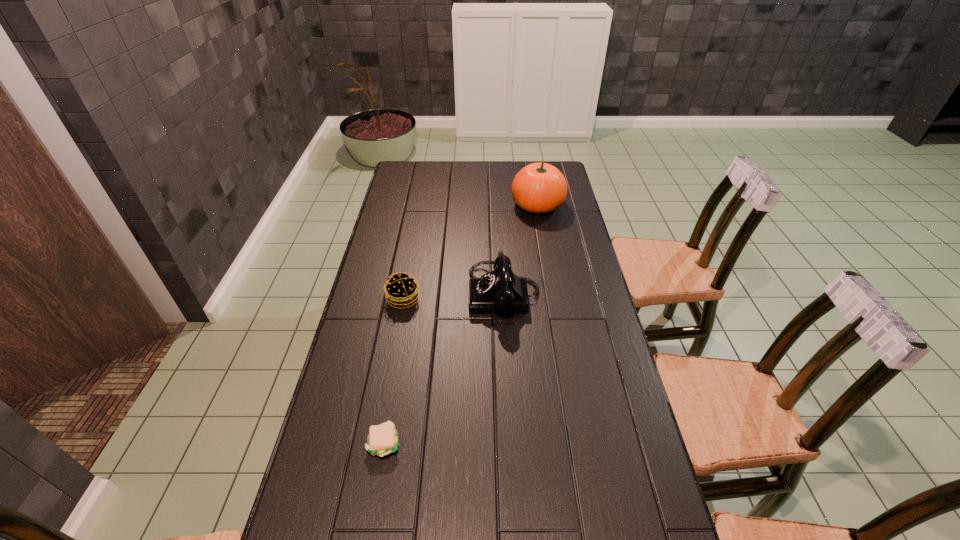
At what (x,y) coordinates should I click in order to perform the action: click on free space between the taller patty and the second tallest object. Please return your answer as a coordinate pair (x, y). The height and width of the screenshot is (540, 960). Looking at the image, I should click on (453, 296).

This screenshot has height=540, width=960. I want to click on vacant area between the shortest object and the third shortest object, so click(x=444, y=368).

The image size is (960, 540). Find the location of `vacant region between the taller patty and the third shortest object`. vacant region between the taller patty and the third shortest object is located at coordinates (453, 296).

Find the location of a particular element. empty space between the pumpkin and the farther patty is located at coordinates (470, 252).

The width and height of the screenshot is (960, 540). Find the location of `vacant area that lies between the tallest object and the nearer patty`. vacant area that lies between the tallest object and the nearer patty is located at coordinates (461, 324).

Where is `vacant area that lies between the farthest object and the nearer patty`? vacant area that lies between the farthest object and the nearer patty is located at coordinates (461, 324).

This screenshot has width=960, height=540. I want to click on free spot between the third shortest object and the nearest object, so click(x=444, y=368).

At what (x,y) coordinates should I click in order to perform the action: click on free point between the telephone and the farthest object. Please return your answer as a coordinate pair (x, y). Looking at the image, I should click on (520, 249).

Locate which object ranks second in proximity to the third tallest object. Please provide its 2D coordinates. Your answer should be formatted as a tuple, i.e. [(x, y)], where the tuple contains the x and y coordinates of a point satisfying the conditions above.

[(383, 439)]

This screenshot has height=540, width=960. Find the location of `object that is the third closest to the taller patty`. object that is the third closest to the taller patty is located at coordinates (538, 188).